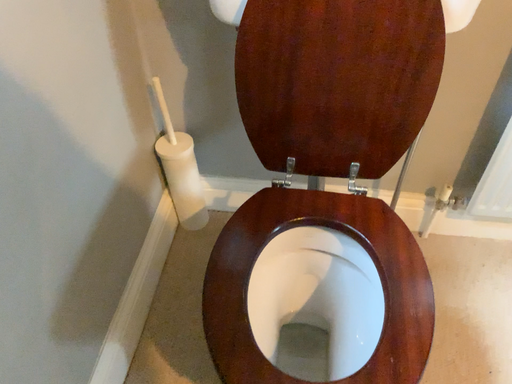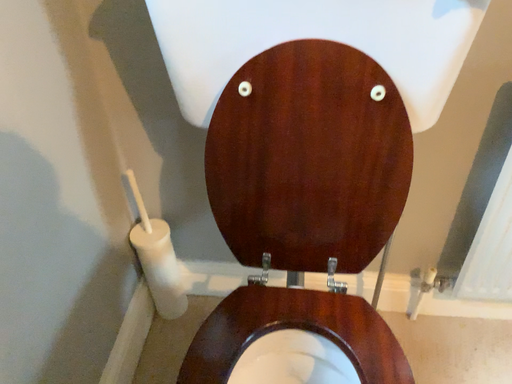
Question: How did the camera likely rotate when shooting the video?

Choices:
 (A) rotated upward
 (B) rotated downward

Answer: (A)